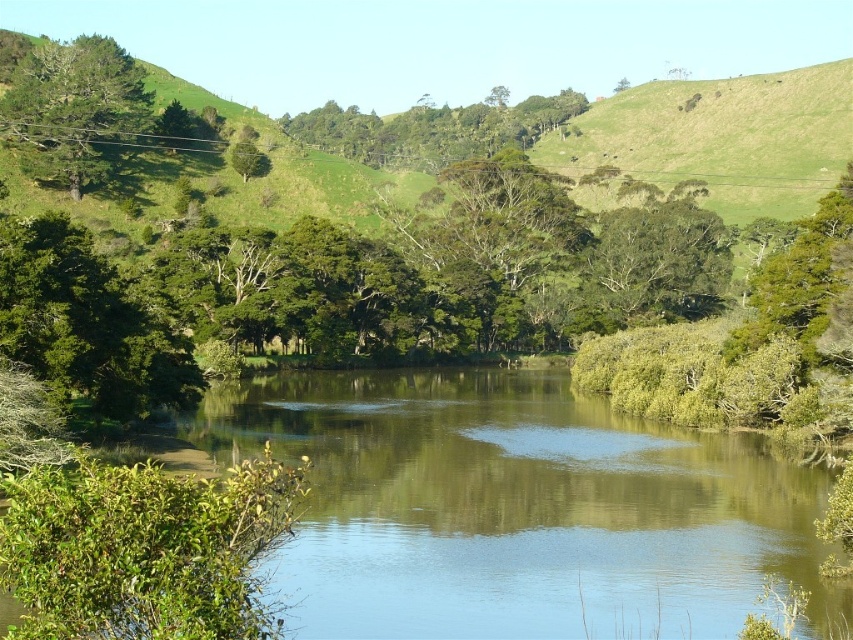
Is green smooth water at center to the right of green leafy tree at upper right from the viewer's perspective?

Incorrect, green smooth water at center is not on the right side of green leafy tree at upper right.

Is green smooth water at center positioned at the back of green leafy tree at upper right?

No.

Between point (585, 548) and point (825, 232), which one is positioned behind?

The point (825, 232) is behind.

Where is `green smooth water at center`? The height and width of the screenshot is (640, 853). green smooth water at center is located at coordinates (518, 509).

Which of these two, green leafy tree at upper left or green leafy tree at upper right, stands taller?

green leafy tree at upper left

Is point (96, 179) positioned behind point (804, 278)?

Yes, it is.

Does point (114, 58) come closer to viewer compared to point (833, 202)?

That is False.

Locate an element on the screen. This screenshot has width=853, height=640. green leafy tree at upper left is located at coordinates (74, 108).

Is green leafy tree at upper center thinner than green leafy tree at upper right?

Incorrect, green leafy tree at upper center's width is not less than green leafy tree at upper right's.

Is point (483, 115) behind point (838, 225)?

Yes, it is.

The height and width of the screenshot is (640, 853). Describe the element at coordinates (432, 129) in the screenshot. I see `green leafy tree at upper center` at that location.

Where is `green leafy tree at upper center`? green leafy tree at upper center is located at coordinates (432, 129).